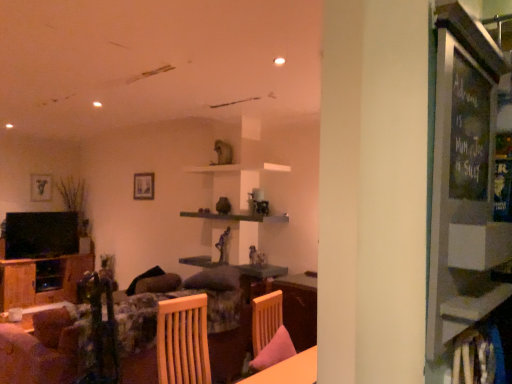
The height and width of the screenshot is (384, 512). What do you see at coordinates (289, 370) in the screenshot?
I see `wooden table at lower center` at bounding box center [289, 370].

Where is `wooden cabinet at left`? This screenshot has width=512, height=384. wooden cabinet at left is located at coordinates (36, 281).

What do you see at coordinates (41, 187) in the screenshot?
I see `matte black picture frame at upper left, placed as the first picture frame when sorted from back to front` at bounding box center [41, 187].

Measure the distance between point (x=47, y=327) and camera.

Point (x=47, y=327) is 2.62 meters away from camera.

Find the location of a particular element. matte glass picture frame at upper center, the 1th picture frame when ordered from right to left is located at coordinates (143, 186).

From the image's perspective, which object appears higher, matte glass picture frame at upper center, which ranks as the 2th picture frame in back-to-front order, or wooden table at lower center?

matte glass picture frame at upper center, which ranks as the 2th picture frame in back-to-front order, from the image's perspective.

Does matte glass picture frame at upper center, the 2th picture frame when ordered from left to right, have a greater width compared to wooden table at lower center?

No, matte glass picture frame at upper center, the 2th picture frame when ordered from left to right, is not wider than wooden table at lower center.

From a real-world perspective, which picture frame is the 2nd one above the wooden table at lower center? Please provide its 2D coordinates.

[(143, 186)]

In the scene shown: Which is less distant, [37,176] or [141,185]?

The point [141,185] is closer.

Which object is closer to the camera taking this photo, matte black picture frame at upper left, the 1th picture frame when ordered from left to right, or matte glass picture frame at upper center, the 1th picture frame when ordered from right to left?

matte glass picture frame at upper center, the 1th picture frame when ordered from right to left, is in front.

What's the angular difference between matte black picture frame at upper left, the 1th picture frame when ordered from left to right, and matte glass picture frame at upper center, the 1th picture frame when ordered from right to left,'s facing directions?

The facing directions of matte black picture frame at upper left, the 1th picture frame when ordered from left to right, and matte glass picture frame at upper center, the 1th picture frame when ordered from right to left, are 92.3 degrees apart.

From a real-world perspective, is matte glass picture frame at upper center, which is counted as the first picture frame, starting from the front, above or below matte black picture frame at upper left, which appears as the second picture frame when viewed from the front?

matte glass picture frame at upper center, which is counted as the first picture frame, starting from the front, is situated higher than matte black picture frame at upper left, which appears as the second picture frame when viewed from the front, in the real world.

Consider the image. Is matte glass picture frame at upper center, the 1th picture frame when ordered from right to left, bigger than matte black picture frame at upper left, the 1th picture frame when ordered from left to right?

Correct, matte glass picture frame at upper center, the 1th picture frame when ordered from right to left, is larger in size than matte black picture frame at upper left, the 1th picture frame when ordered from left to right.

From the image's perspective, is matte glass picture frame at upper center, which is counted as the first picture frame, starting from the front, located above matte black picture frame at upper left, the 1th picture frame when ordered from left to right?

Correct, matte glass picture frame at upper center, which is counted as the first picture frame, starting from the front, appears higher than matte black picture frame at upper left, the 1th picture frame when ordered from left to right, in the image.

Considering the sizes of objects matte glass picture frame at upper center, which is counted as the first picture frame, starting from the front, and matte black picture frame at upper left, which appears as the second picture frame when viewed from the front, in the image provided, who is taller, matte glass picture frame at upper center, which is counted as the first picture frame, starting from the front, or matte black picture frame at upper left, which appears as the second picture frame when viewed from the front,?

Standing taller between the two is matte black picture frame at upper left, which appears as the second picture frame when viewed from the front.

In the scene shown: Which is in front, wooden shelf at center or matte black picture frame at upper left, the 1th picture frame when ordered from left to right?

wooden shelf at center is in front.

At what (x,y) coordinates should I click in order to perform the action: click on the 2nd picture frame counting from the left of the wooden shelf at center. Please return your answer as a coordinate pair (x, y). The height and width of the screenshot is (384, 512). Looking at the image, I should click on (41, 187).

Considering the relative sizes of wooden shelf at center and matte black picture frame at upper left, placed as the first picture frame when sorted from back to front, in the image provided, is wooden shelf at center thinner than matte black picture frame at upper left, placed as the first picture frame when sorted from back to front,?

Incorrect, the width of wooden shelf at center is not less than that of matte black picture frame at upper left, placed as the first picture frame when sorted from back to front.

Would you say matte black picture frame at upper left, the 1th picture frame when ordered from left to right, is part of wooden shelf at center's contents?

No, matte black picture frame at upper left, the 1th picture frame when ordered from left to right, is not surrounded by wooden shelf at center.

From the picture: Which object is thinner, matte glass picture frame at upper center, which ranks as the 2th picture frame in back-to-front order, or wooden shelf at center?

With smaller width is matte glass picture frame at upper center, which ranks as the 2th picture frame in back-to-front order.

Is wooden shelf at center surrounded by matte glass picture frame at upper center, the 1th picture frame when ordered from right to left?

No, wooden shelf at center is located outside of matte glass picture frame at upper center, the 1th picture frame when ordered from right to left.

Is wooden shelf at center at the back of matte glass picture frame at upper center, which is counted as the first picture frame, starting from the front?

No.

From the image's perspective, relative to wooden shelf at center, is matte glass picture frame at upper center, which ranks as the 2th picture frame in back-to-front order, above or below?

matte glass picture frame at upper center, which ranks as the 2th picture frame in back-to-front order, is situated higher than wooden shelf at center in the image.

At what (x,y) coordinates should I click in order to perform the action: click on couch above the wooden cabinet at left (from a real-world perspective). Please return your answer as a coordinate pair (x, y). The image size is (512, 384). Looking at the image, I should click on (156, 332).

From the image's perspective, is floral fabric couch at lower left above wooden cabinet at left?

Indeed, from the image's perspective, floral fabric couch at lower left is shown above wooden cabinet at left.

Considering the points (84, 339) and (3, 293), which point is in front, point (84, 339) or point (3, 293)?

The point (84, 339) is closer to the camera.

Considering the sizes of objects floral fabric couch at lower left and wooden cabinet at left in the image provided, who is bigger, floral fabric couch at lower left or wooden cabinet at left?

Bigger between the two is floral fabric couch at lower left.

Is point (311, 351) more distant than point (218, 214)?

That is False.

Is wooden table at lower center further to the viewer compared to wooden shelf at center?

No, the depth of wooden table at lower center is less than that of wooden shelf at center.

From a real-world perspective, between wooden table at lower center and wooden shelf at center, who is vertically higher?

From a 3D spatial view, wooden shelf at center is above.

What are the coordinates of `shelf on the left of the wooden table at lower center` in the screenshot? It's located at (237, 217).

From a real-world perspective, count 2nd picture frames upward from the wooden table at lower center and point to it. Please provide its 2D coordinates.

[(143, 186)]

Where is `picture frame below the matte glass picture frame at upper center, the 2th picture frame when ordered from left to right (from the image's perspective)`? picture frame below the matte glass picture frame at upper center, the 2th picture frame when ordered from left to right (from the image's perspective) is located at coordinates point(41,187).

Which object lies nearer to the anchor point wooden cabinet at left, matte glass picture frame at upper center, the 1th picture frame when ordered from right to left, or floral fabric couch at lower left?

Among the two, matte glass picture frame at upper center, the 1th picture frame when ordered from right to left, is located nearer to wooden cabinet at left.

Considering their positions, is wooden shelf at center positioned further to matte black picture frame at upper left, which appears as the second picture frame when viewed from the front, than floral fabric couch at lower left?

floral fabric couch at lower left is further to matte black picture frame at upper left, which appears as the second picture frame when viewed from the front.

Looking at the image, which one is located closer to wooden table at lower center, matte black picture frame at upper left, placed as the first picture frame when sorted from back to front, or floral fabric couch at lower left?

floral fabric couch at lower left lies closer to wooden table at lower center than the other object.

Considering their positions, is wooden cabinet at left positioned closer to wooden shelf at center than wooden table at lower center?

The object closer to wooden shelf at center is wooden table at lower center.

Considering their positions, is matte glass picture frame at upper center, the 1th picture frame when ordered from right to left, positioned closer to wooden table at lower center than wooden cabinet at left?

matte glass picture frame at upper center, the 1th picture frame when ordered from right to left, lies closer to wooden table at lower center than the other object.

Considering their positions, is floral fabric couch at lower left positioned further to wooden table at lower center than matte glass picture frame at upper center, which ranks as the 2th picture frame in back-to-front order?

Based on the image, matte glass picture frame at upper center, which ranks as the 2th picture frame in back-to-front order, appears to be further to wooden table at lower center.

Looking at the image, which one is located further to floral fabric couch at lower left, wooden shelf at center or matte glass picture frame at upper center, which ranks as the 2th picture frame in back-to-front order?

The object further to floral fabric couch at lower left is matte glass picture frame at upper center, which ranks as the 2th picture frame in back-to-front order.

From the image, which object appears to be nearer to floral fabric couch at lower left, matte glass picture frame at upper center, which is counted as the first picture frame, starting from the front, or wooden cabinet at left?

matte glass picture frame at upper center, which is counted as the first picture frame, starting from the front, is closer to floral fabric couch at lower left.

Locate an element on the screen. The height and width of the screenshot is (384, 512). couch between wooden table at lower center and wooden shelf at center along the z-axis is located at coordinates (156, 332).

You are a GUI agent. You are given a task and a screenshot of the screen. Output one action in this format:
    pyautogui.click(x=<x>, y=<y>)
    Task: Click on the shelf between floral fabric couch at lower left and matte black picture frame at upper left, which appears as the second picture frame when viewed from the front, in the front-back direction
    
    Given the screenshot: What is the action you would take?
    pyautogui.click(x=237, y=217)

Where is `shelf between wooden cabinet at left and wooden table at lower center in the horizontal direction`? The height and width of the screenshot is (384, 512). shelf between wooden cabinet at left and wooden table at lower center in the horizontal direction is located at coordinates (237, 217).

Locate an element on the screen. shelf positioned between floral fabric couch at lower left and matte glass picture frame at upper center, the 2th picture frame when ordered from left to right, from near to far is located at coordinates (237, 217).